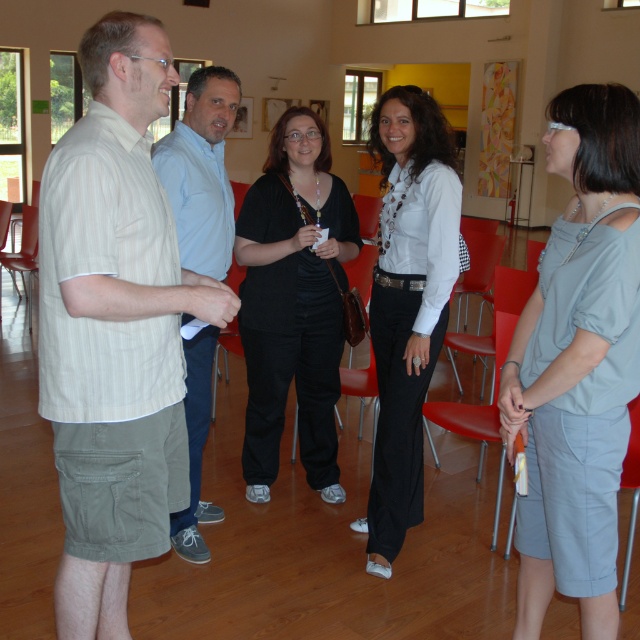
You are standing in the room and want to move from the matte plastic chair at lower left to the light blue fabric skirt at lower right. Which direction should you move?

You should move to the right to reach the light blue fabric skirt at lower right from the matte plastic chair at lower left because it is located to the right of the chair.

What object is located at the coordinates point (292, 301)?

The point (292, 301) indicates the location of the black matte shirt at center.

You are a photographer setting up a shoot in this room. You need to place a model wearing a light blue fabric skirt at lower right and a model sitting on a matte plastic chair at lower left. Since the skirt is narrower than the chair, where should you position them to ensure they don not block each other?

The light blue fabric skirt at lower right is narrower than the matte plastic chair at lower left. To prevent blocking, place the narrower skirt closer to the foreground and the wider chair slightly behind it, using their size difference to create depth without obstruction.